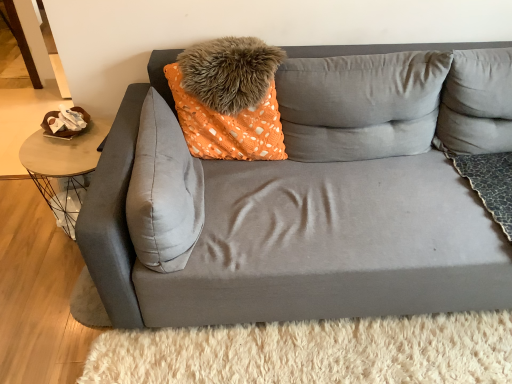
Question: From a real-world perspective, is gray fabric pillow at center, which is the fourth pillow in left-to-right order, below suede gray pillow at center, placed as the fifth pillow when sorted from right to left?

Choices:
 (A) no
 (B) yes

Answer: (A)

Question: Does gray fabric pillow at center, marked as the 2th pillow in a right-to-left arrangement, have a lesser width compared to suede gray pillow at center, the first pillow positioned from the left?

Choices:
 (A) no
 (B) yes

Answer: (B)

Question: Does gray fabric pillow at center, which is the fourth pillow in left-to-right order, have a lesser height compared to suede gray pillow at center, the first pillow positioned from the left?

Choices:
 (A) no
 (B) yes

Answer: (A)

Question: Does gray fabric pillow at center, marked as the 2th pillow in a right-to-left arrangement, have a greater width compared to suede gray pillow at center, placed as the fifth pillow when sorted from right to left?

Choices:
 (A) no
 (B) yes

Answer: (A)

Question: Is gray fabric pillow at center, which is the fourth pillow in left-to-right order, positioned in front of suede gray pillow at center, placed as the fifth pillow when sorted from right to left?

Choices:
 (A) yes
 (B) no

Answer: (B)

Question: Considering the positions of suede gray pillow at center, placed as the fifth pillow when sorted from right to left, and matte gray couch at center in the image, is suede gray pillow at center, placed as the fifth pillow when sorted from right to left, wider or thinner than matte gray couch at center?

Choices:
 (A) thin
 (B) wide

Answer: (A)

Question: Considering the positions of suede gray pillow at center, the first pillow positioned from the left, and matte gray couch at center in the image, is suede gray pillow at center, the first pillow positioned from the left, bigger or smaller than matte gray couch at center?

Choices:
 (A) big
 (B) small

Answer: (B)

Question: In terms of height, does suede gray pillow at center, the first pillow positioned from the left, look taller or shorter compared to matte gray couch at center?

Choices:
 (A) short
 (B) tall

Answer: (A)

Question: From a real-world perspective, is suede gray pillow at center, the first pillow positioned from the left, physically located above or below matte gray couch at center?

Choices:
 (A) above
 (B) below

Answer: (A)

Question: From the image's perspective, relative to orange dotted fabric pillow at center, which is the 2th pillow in left-to-right order, is suede gray pillow at center, the first pillow positioned from the left, above or below?

Choices:
 (A) below
 (B) above

Answer: (A)

Question: Is suede gray pillow at center, the first pillow positioned from the left, spatially inside orange dotted fabric pillow at center, which is the 2th pillow in left-to-right order, or outside of it?

Choices:
 (A) outside
 (B) inside

Answer: (A)

Question: Is suede gray pillow at center, the first pillow positioned from the left, taller or shorter than orange dotted fabric pillow at center, which is the 2th pillow in left-to-right order?

Choices:
 (A) tall
 (B) short

Answer: (B)

Question: Is suede gray pillow at center, placed as the fifth pillow when sorted from right to left, bigger or smaller than orange dotted fabric pillow at center, which appears as the 4th pillow when viewed from the right?

Choices:
 (A) big
 (B) small

Answer: (B)

Question: Is metallic wire table at left wider or thinner than orange dotted fabric pillow at center, which is the 2th pillow in left-to-right order?

Choices:
 (A) wide
 (B) thin

Answer: (A)

Question: Is metallic wire table at left in front of or behind orange dotted fabric pillow at center, which is the 2th pillow in left-to-right order, in the image?

Choices:
 (A) behind
 (B) front

Answer: (A)